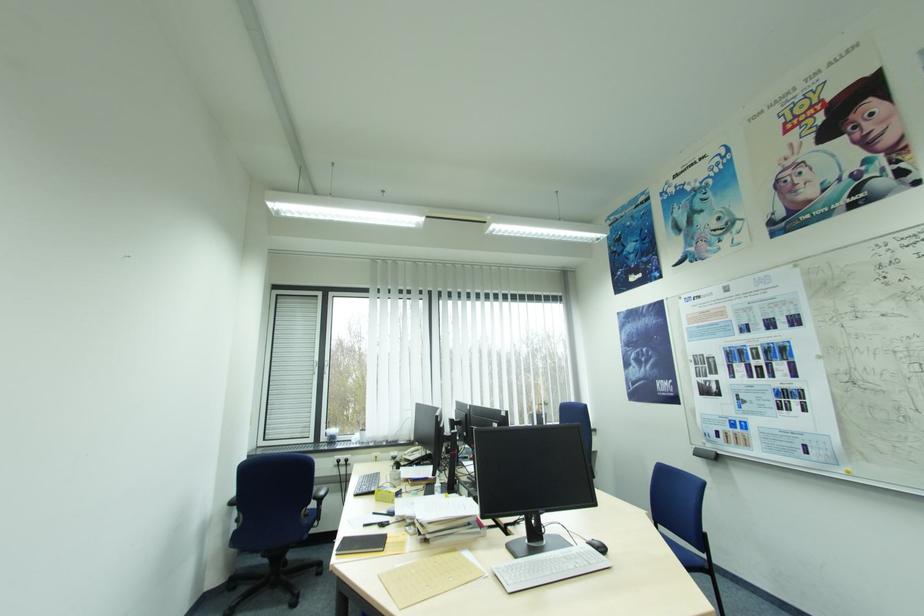
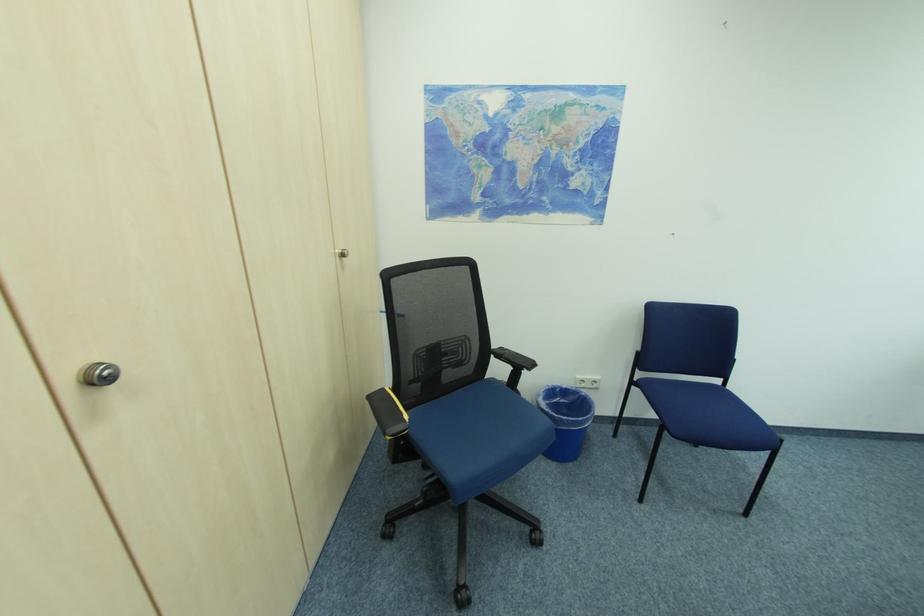
Based on the continuous images, in which direction is the camera rotating?

The camera rotated toward left-down.